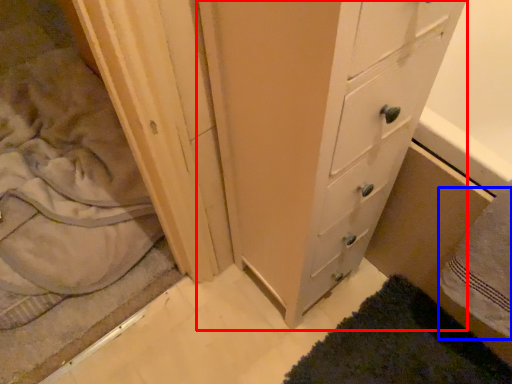
Question: Which object is closer to the camera taking this photo, chest of drawers (highlighted by a red box) or bath towel (highlighted by a blue box)?

Choices:
 (A) chest of drawers
 (B) bath towel

Answer: (A)